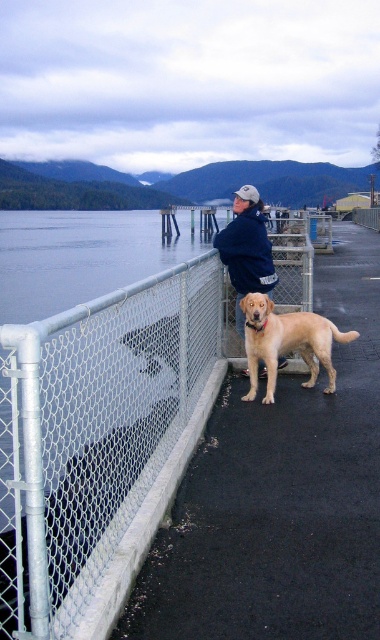
Between white chain-link fence at center-left and golden fur dog at center, which one has more height?

Standing taller between the two is white chain-link fence at center-left.

Who is more forward, (114, 330) or (308, 380)?

Positioned in front is point (114, 330).

I want to click on white chain-link fence at center-left, so click(x=95, y=432).

You are a GUI agent. You are given a task and a screenshot of the screen. Output one action in this format:
    pyautogui.click(x=<x>, y=<y>)
    Task: Click on the white chain-link fence at center-left
    
    Given the screenshot: What is the action you would take?
    pyautogui.click(x=95, y=432)

How much distance is there between golden fur dog at center and dark blue jacket at center?

The distance of golden fur dog at center from dark blue jacket at center is 18.32 inches.

The image size is (380, 640). What do you see at coordinates (286, 342) in the screenshot?
I see `golden fur dog at center` at bounding box center [286, 342].

Image resolution: width=380 pixels, height=640 pixels. What are the coordinates of `golden fur dog at center` in the screenshot? It's located at click(x=286, y=342).

Which is more to the right, white chain-link fence at center-left or dark blue jacket at center?

From the viewer's perspective, dark blue jacket at center appears more on the right side.

Does white chain-link fence at center-left have a lesser height compared to dark blue jacket at center?

A: Indeed, white chain-link fence at center-left has a lesser height compared to dark blue jacket at center.

Is point (183, 355) closer to viewer compared to point (240, 333)?

Yes, point (183, 355) is closer to viewer.

The image size is (380, 640). Find the location of `white chain-link fence at center-left`. white chain-link fence at center-left is located at coordinates (95, 432).